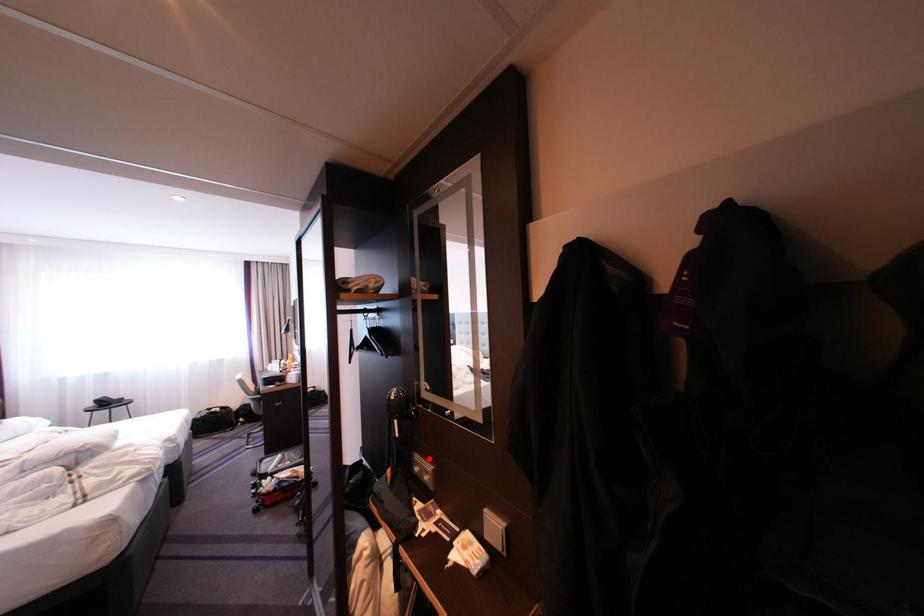
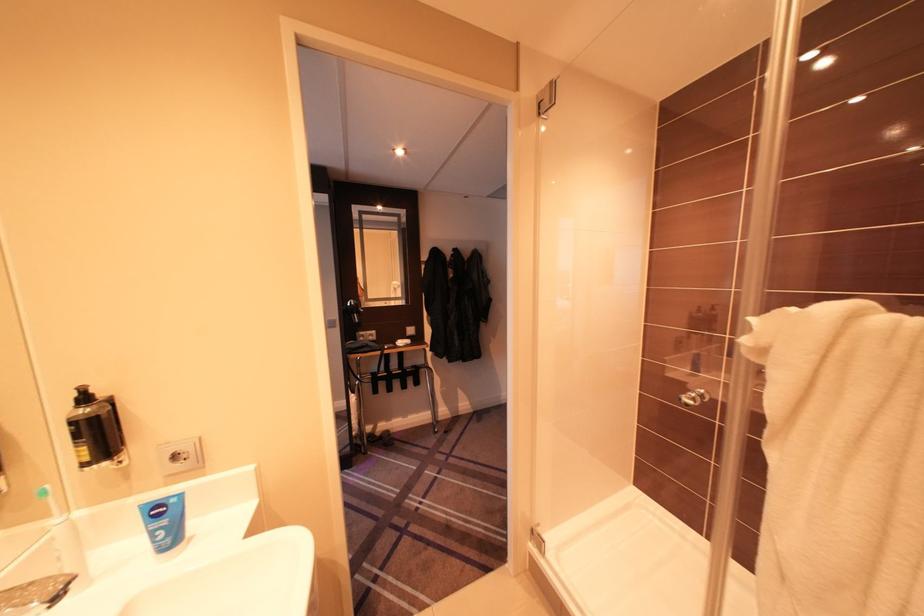
The point at the highlighted location is marked in the first image. Where is the corresponding point in the second image?

(372, 334)